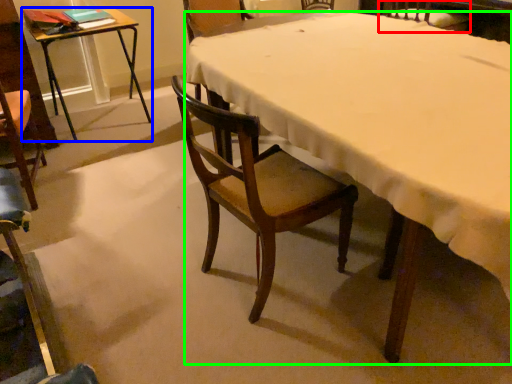
Question: Based on their relative distances, which object is farther from chair (highlighted by a red box)? Choose from table (highlighted by a blue box) and desk (highlighted by a green box).

Choices:
 (A) table
 (B) desk

Answer: (A)